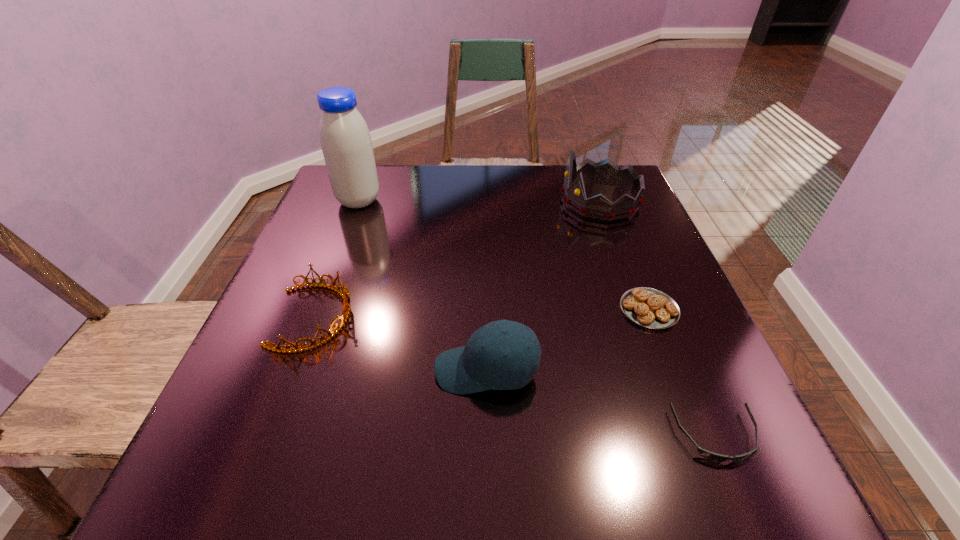
You are a GUI agent. You are given a task and a screenshot of the screen. Output one action in this format:
    pyautogui.click(x=<x>, y=<y>)
    Task: Click on the free space that is in between the third tallest object and the soya milk
    The image size is (960, 540).
    Given the screenshot: What is the action you would take?
    pyautogui.click(x=422, y=286)

The height and width of the screenshot is (540, 960). What are the coordinates of `empty space between the soya milk and the pastry` in the screenshot? It's located at (504, 255).

Where is `unoccupied area between the baseball cap and the soya milk`? unoccupied area between the baseball cap and the soya milk is located at coordinates (422, 286).

Locate which object is the second closest to the farther tiara. Please provide its 2D coordinates. Your answer should be formatted as a tuple, i.e. [(x, y)], where the tuple contains the x and y coordinates of a point satisfying the conditions above.

[(480, 365)]

Find the location of `object that can be found as the third closest to the sunglasses`. object that can be found as the third closest to the sunglasses is located at coordinates (607, 172).

Find the location of `free space that satisfies the following two spatial constraints: 1. on the front side of the tallest object; 2. on the front-facing side of the shorter tiara`. free space that satisfies the following two spatial constraints: 1. on the front side of the tallest object; 2. on the front-facing side of the shorter tiara is located at coordinates (315, 317).